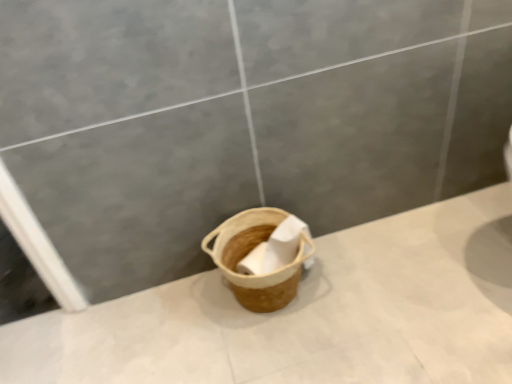
This screenshot has width=512, height=384. What do you see at coordinates (249, 251) in the screenshot?
I see `brown woven bucket at center` at bounding box center [249, 251].

Measure the distance between brown woven bucket at center and camera.

brown woven bucket at center and camera are 3.66 feet apart from each other.

You are a GUI agent. You are given a task and a screenshot of the screen. Output one action in this format:
    pyautogui.click(x=<x>, y=<y>)
    Task: Click on the brown woven bucket at center
    The width and height of the screenshot is (512, 384).
    Given the screenshot: What is the action you would take?
    pyautogui.click(x=249, y=251)

Where is `brown woven bucket at center`? The image size is (512, 384). brown woven bucket at center is located at coordinates (249, 251).